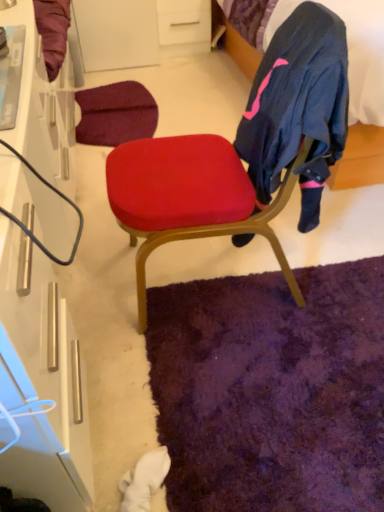
Question: Should I look upward or downward to see matte red cushion at center?

Choices:
 (A) up
 (B) down

Answer: (A)

Question: Is white glossy cabinet at left far away from velvet dark blue bed at upper right?

Choices:
 (A) yes
 (B) no

Answer: (A)

Question: Is white glossy cabinet at left further to camera compared to velvet dark blue bed at upper right?

Choices:
 (A) yes
 (B) no

Answer: (B)

Question: Can you confirm if white glossy cabinet at left is smaller than velvet dark blue bed at upper right?

Choices:
 (A) no
 (B) yes

Answer: (B)

Question: Could you tell me if white glossy cabinet at left is turned towards velvet dark blue bed at upper right?

Choices:
 (A) no
 (B) yes

Answer: (B)

Question: From the image's perspective, is white glossy cabinet at left over velvet dark blue bed at upper right?

Choices:
 (A) yes
 (B) no

Answer: (B)

Question: Is white glossy cabinet at left located outside velvet dark blue bed at upper right?

Choices:
 (A) no
 (B) yes

Answer: (B)

Question: Is white matte drawer at upper center to the right of purple shaggy rug at lower center from the viewer's perspective?

Choices:
 (A) yes
 (B) no

Answer: (B)

Question: Considering the relative sizes of white matte drawer at upper center and purple shaggy rug at lower center in the image provided, is white matte drawer at upper center smaller than purple shaggy rug at lower center?

Choices:
 (A) yes
 (B) no

Answer: (B)

Question: From the image's perspective, is white matte drawer at upper center on purple shaggy rug at lower center?

Choices:
 (A) yes
 (B) no

Answer: (A)

Question: Are white matte drawer at upper center and purple shaggy rug at lower center making contact?

Choices:
 (A) no
 (B) yes

Answer: (A)

Question: Is white matte drawer at upper center outside purple shaggy rug at lower center?

Choices:
 (A) yes
 (B) no

Answer: (A)

Question: Can you confirm if white matte drawer at upper center is taller than purple shaggy rug at lower center?

Choices:
 (A) yes
 (B) no

Answer: (A)

Question: Is velvet dark blue bed at upper right facing towards matte red cushion at center?

Choices:
 (A) no
 (B) yes

Answer: (A)